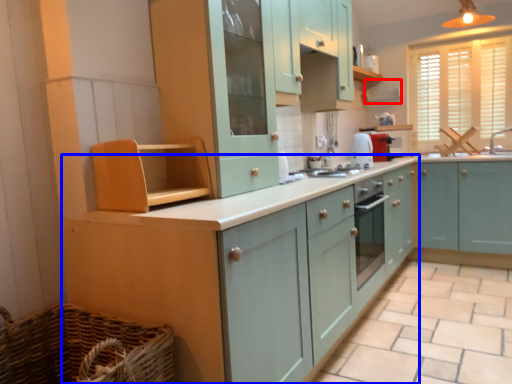
Question: Which of the following is the farthest to the observer, exhaust hood (highlighted by a red box) or cabinetry (highlighted by a blue box)?

Choices:
 (A) exhaust hood
 (B) cabinetry

Answer: (A)